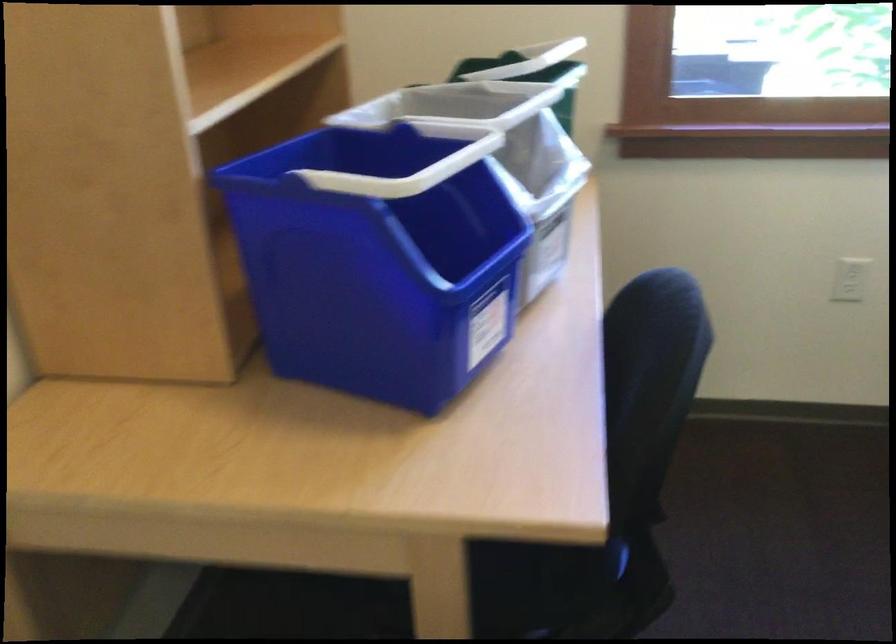
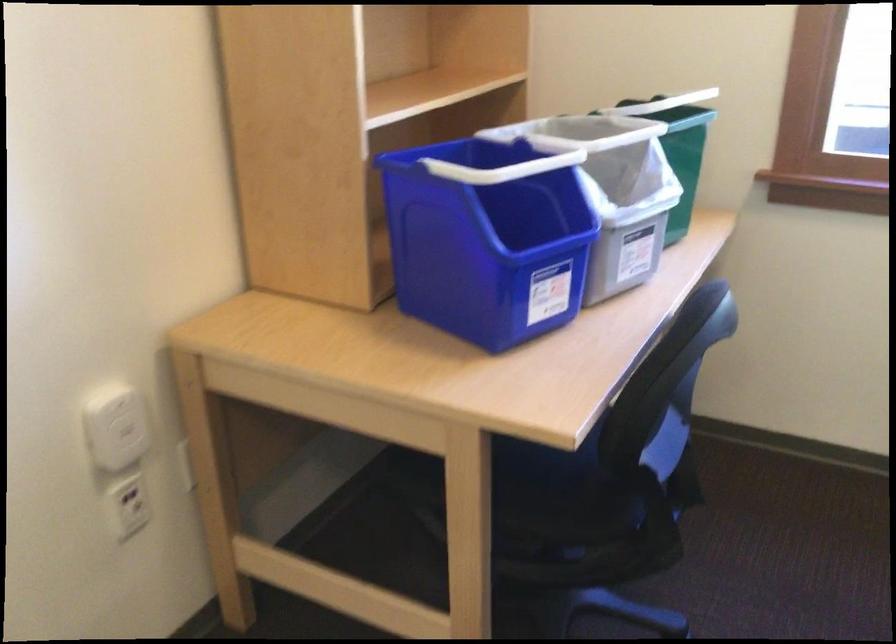
The images are taken continuously from a first-person perspective. In which direction are you moving?

The cameraman walked toward right, backward.